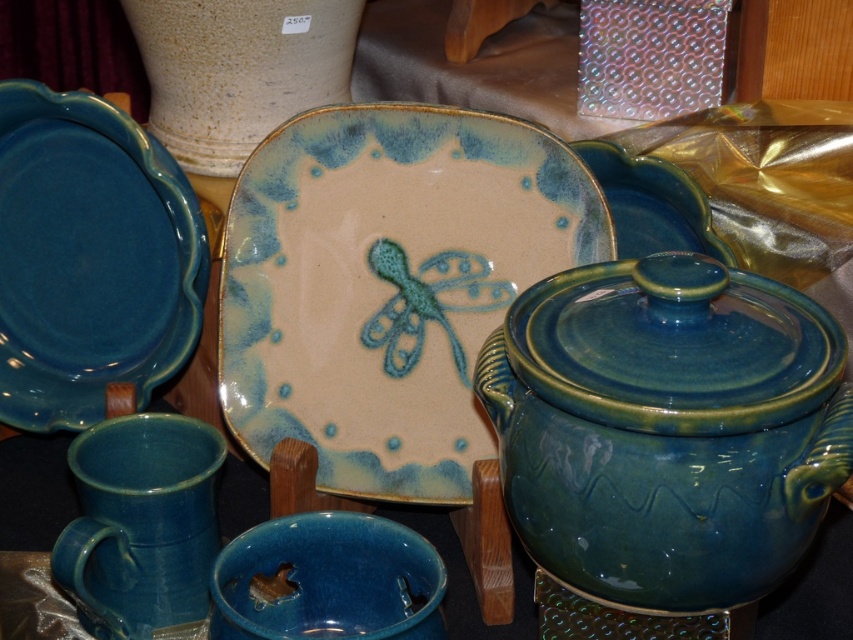
You are arranging flowers in the speckled ceramic vase at upper center and need to place it next to the matte blue bowl at center. According to the scene description, where should you position the speckled ceramic vase relative to the matte blue bowl?

The speckled ceramic vase at upper center should be placed to the left of the matte blue bowl at center as it is positioned on the left side of it according to the description.

You are a delivery person who needs to place a new teacup that is 2 inches in diameter on the table between the blue glossy teapot at right and the matte blue plate at left. Is there enough space between them to place the teacup without it overlapping either object?

The blue glossy teapot at right and matte blue plate at left are 18.08 inches apart. Since the teacup is only 2 inches in diameter, there is plenty of space between them to place the teacup without overlapping either object.